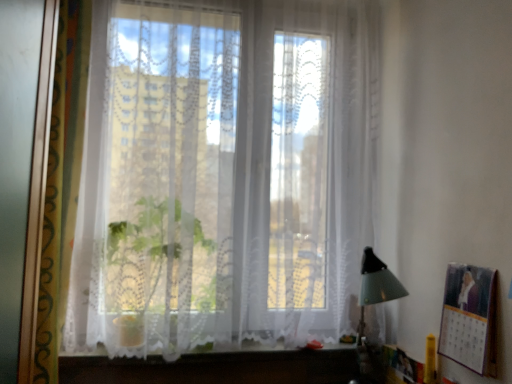
Question: Does metallic silver picture frame at right turn towards white lace vanity at lower center?

Choices:
 (A) yes
 (B) no

Answer: (B)

Question: Is metallic silver picture frame at right next to white lace vanity at lower center?

Choices:
 (A) no
 (B) yes

Answer: (A)

Question: Does metallic silver picture frame at right appear on the left side of white lace vanity at lower center?

Choices:
 (A) no
 (B) yes

Answer: (A)

Question: Are metallic silver picture frame at right and white lace vanity at lower center far apart?

Choices:
 (A) yes
 (B) no

Answer: (B)

Question: Does metallic silver picture frame at right have a larger size compared to white lace vanity at lower center?

Choices:
 (A) yes
 (B) no

Answer: (B)

Question: From the image's perspective, is metallic silver picture frame at right over white lace vanity at lower center?

Choices:
 (A) yes
 (B) no

Answer: (A)

Question: Is white lace vanity at lower center aimed at transparent lace curtain at center?

Choices:
 (A) yes
 (B) no

Answer: (B)

Question: Can you confirm if white lace vanity at lower center is wider than transparent lace curtain at center?

Choices:
 (A) no
 (B) yes

Answer: (A)

Question: From the image's perspective, would you say white lace vanity at lower center is positioned over transparent lace curtain at center?

Choices:
 (A) no
 (B) yes

Answer: (A)

Question: Is white lace vanity at lower center not within transparent lace curtain at center?

Choices:
 (A) yes
 (B) no

Answer: (A)

Question: Considering the relative sizes of white lace vanity at lower center and transparent lace curtain at center in the image provided, is white lace vanity at lower center shorter than transparent lace curtain at center?

Choices:
 (A) yes
 (B) no

Answer: (A)

Question: Is the position of white lace vanity at lower center less distant than that of transparent lace curtain at center?

Choices:
 (A) no
 (B) yes

Answer: (A)

Question: Does transparent lace curtain at center have a lesser height compared to metallic silver picture frame at right?

Choices:
 (A) yes
 (B) no

Answer: (B)